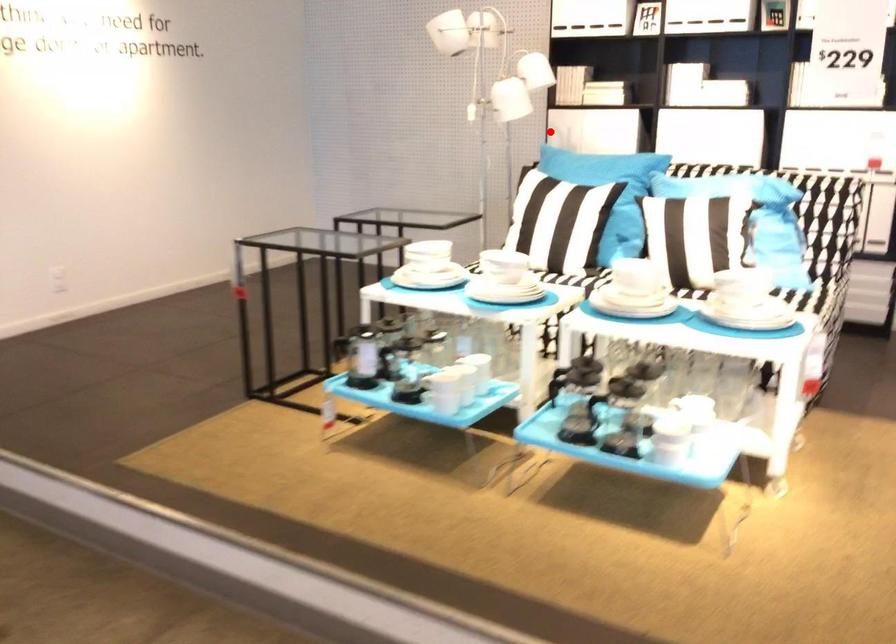
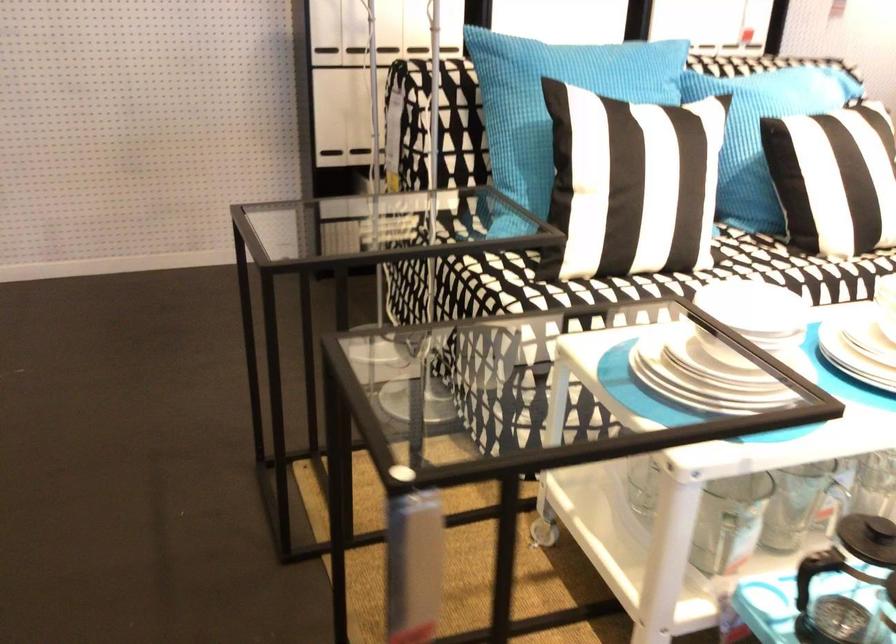
Question: I am providing you with two images of the same scene from different viewpoints. A red point is shown in image1. For the corresponding object point in image2, is it positioned nearer or farther from the camera?

Choices:
 (A) Nearer
 (B) Farther

Answer: (A)